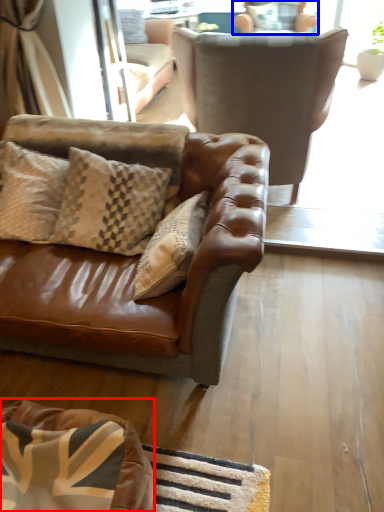
Question: Among these objects, which one is farthest to the camera, dog bed (highlighted by a red box) or chair (highlighted by a blue box)?

Choices:
 (A) dog bed
 (B) chair

Answer: (B)